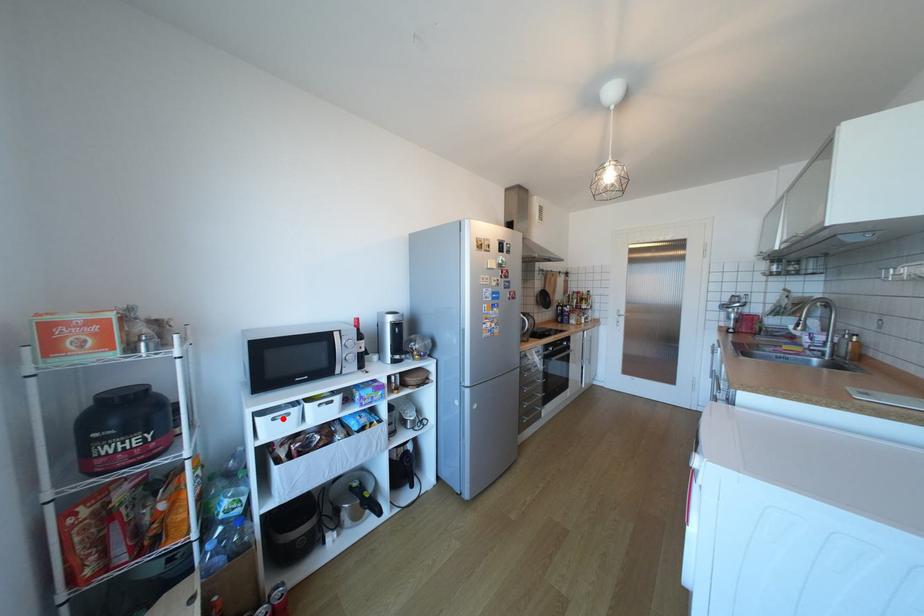
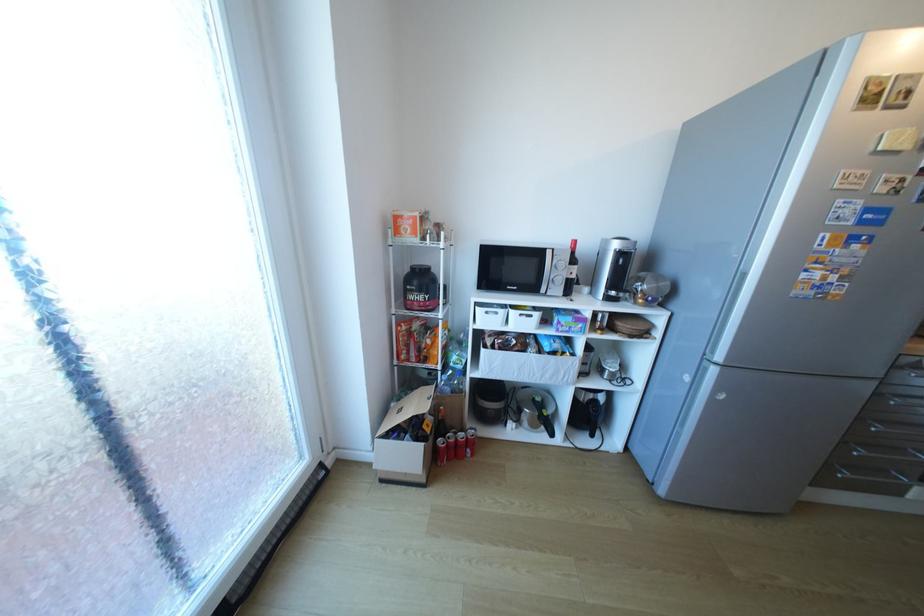
Locate, in the second image, the point that corresponds to the highlighted location in the first image.

(495, 313)